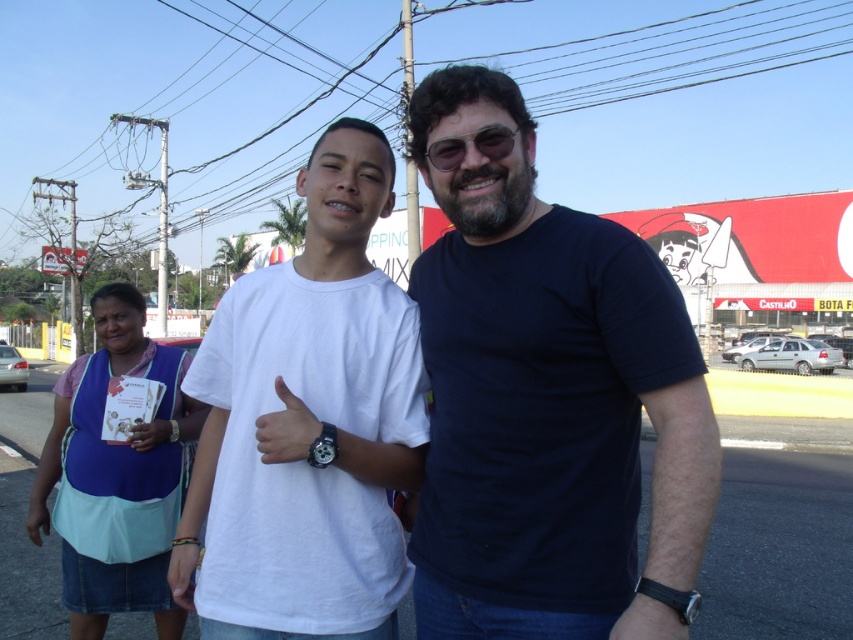
Question: Which point appears closest to the camera in this image?

Choices:
 (A) (151, 460)
 (B) (273, 492)
 (C) (500, 138)

Answer: (C)

Question: Can you confirm if white matte t-shirt at center is positioned to the left of sunglasses at center?

Choices:
 (A) yes
 (B) no

Answer: (A)

Question: Which of the following is the farthest from the observer?

Choices:
 (A) (143, 426)
 (B) (442, 168)

Answer: (A)

Question: Which point is closer to the camera taking this photo?

Choices:
 (A) (146, 449)
 (B) (215, 312)
 (C) (639, 604)

Answer: (C)

Question: In this image, where is dark blue t-shirt at center located relative to blue fabric purse at lower left?

Choices:
 (A) below
 (B) above

Answer: (B)

Question: Is white matte t-shirt at center behind blue fabric at center?

Choices:
 (A) no
 (B) yes

Answer: (A)